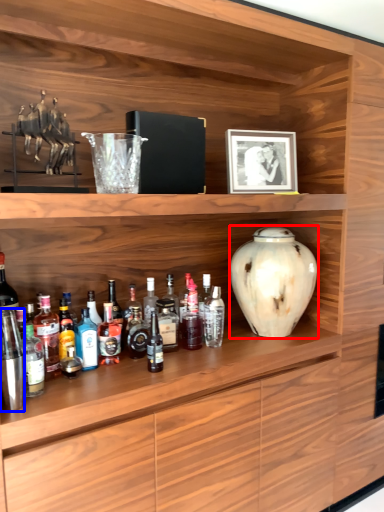
Question: Among these objects, which one is farthest to the camera, vase (highlighted by a red box) or bottle (highlighted by a blue box)?

Choices:
 (A) vase
 (B) bottle

Answer: (A)